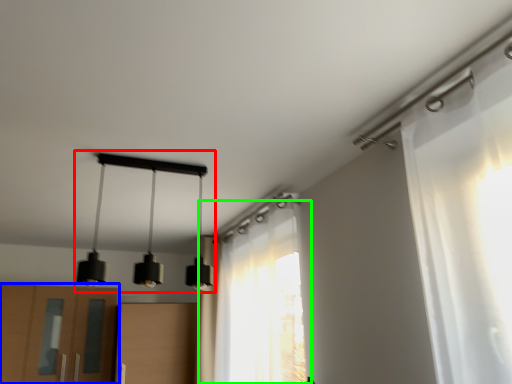
Question: Which object is positioned closest to lamp (highlighted by a red box)? Select from cabinetry (highlighted by a blue box) and curtain (highlighted by a green box).

Choices:
 (A) cabinetry
 (B) curtain

Answer: (A)